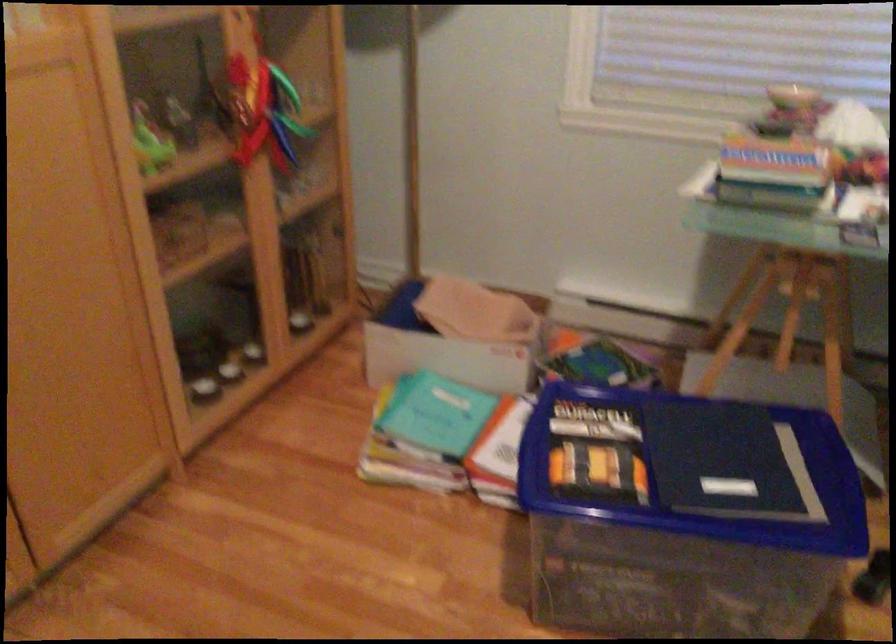
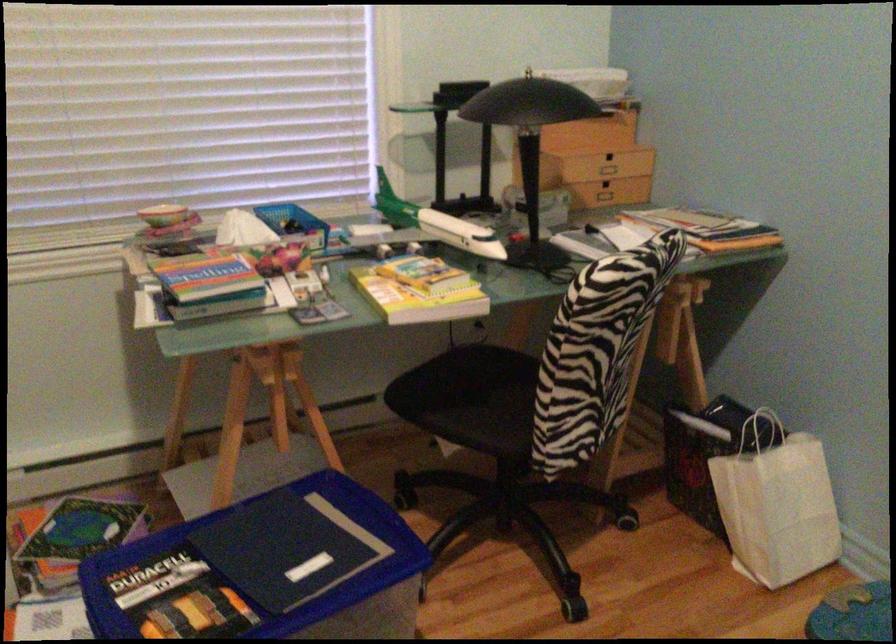
In the second image, find the point that corresponds to (690,467) in the first image.

(264, 570)